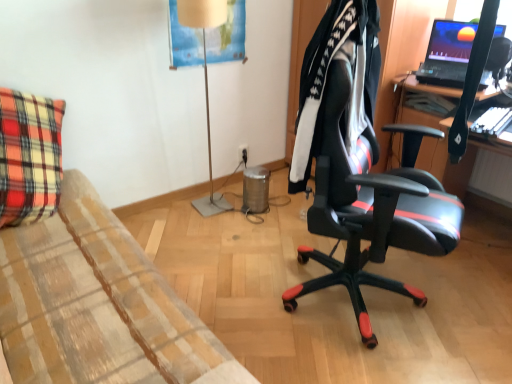
Question: Is black plastic power outlet at center at the right side of black leather office chair at center?

Choices:
 (A) yes
 (B) no

Answer: (B)

Question: Does black plastic power outlet at center lie in front of black leather office chair at center?

Choices:
 (A) no
 (B) yes

Answer: (A)

Question: Is black plastic power outlet at center further to camera compared to black leather office chair at center?

Choices:
 (A) no
 (B) yes

Answer: (B)

Question: Does black plastic power outlet at center have a greater height compared to black leather office chair at center?

Choices:
 (A) no
 (B) yes

Answer: (A)

Question: Is black plastic power outlet at center not within black leather office chair at center?

Choices:
 (A) no
 (B) yes

Answer: (B)

Question: Considering their positions, is black plastic power outlet at center located in front of or behind matte black laptop at upper right?

Choices:
 (A) behind
 (B) front

Answer: (A)

Question: Visually, is black plastic power outlet at center positioned to the left or to the right of matte black laptop at upper right?

Choices:
 (A) left
 (B) right

Answer: (A)

Question: From a real-world perspective, is black plastic power outlet at center physically located above or below matte black laptop at upper right?

Choices:
 (A) above
 (B) below

Answer: (B)

Question: In terms of size, does black plastic power outlet at center appear bigger or smaller than matte black laptop at upper right?

Choices:
 (A) small
 (B) big

Answer: (A)

Question: From their relative heights in the image, would you say matte black laptop at upper right is taller or shorter than black leather office chair at center?

Choices:
 (A) tall
 (B) short

Answer: (B)

Question: Is matte black laptop at upper right spatially inside black leather office chair at center, or outside of it?

Choices:
 (A) outside
 (B) inside

Answer: (A)

Question: Is matte black laptop at upper right in front of or behind black leather office chair at center in the image?

Choices:
 (A) behind
 (B) front

Answer: (A)

Question: From a real-world perspective, is matte black laptop at upper right above or below black leather office chair at center?

Choices:
 (A) above
 (B) below

Answer: (A)

Question: Considering the positions of black plastic power outlet at center and matte beige lamp at center in the image, is black plastic power outlet at center bigger or smaller than matte beige lamp at center?

Choices:
 (A) small
 (B) big

Answer: (A)

Question: Is point (240, 158) closer or farther from the camera than point (208, 137)?

Choices:
 (A) closer
 (B) farther

Answer: (B)